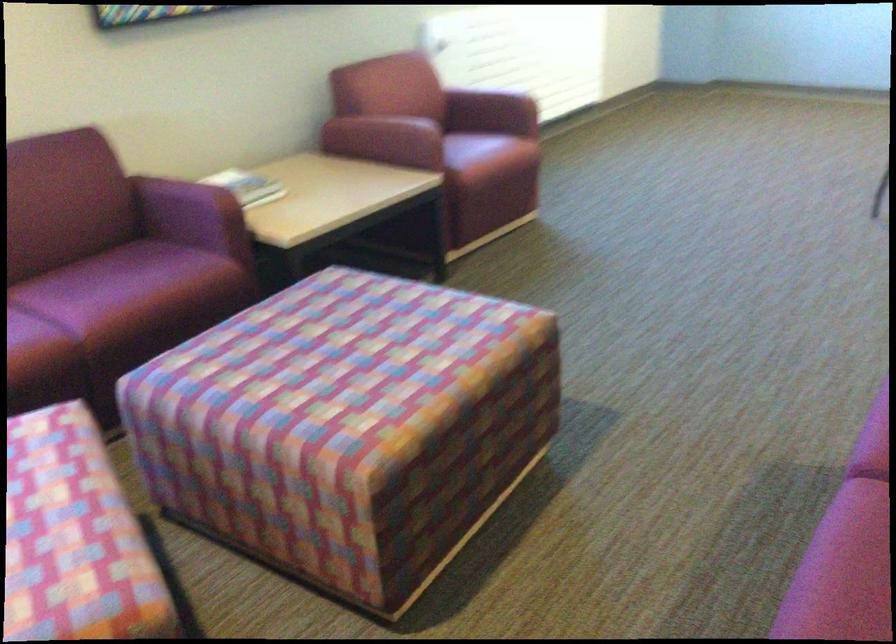
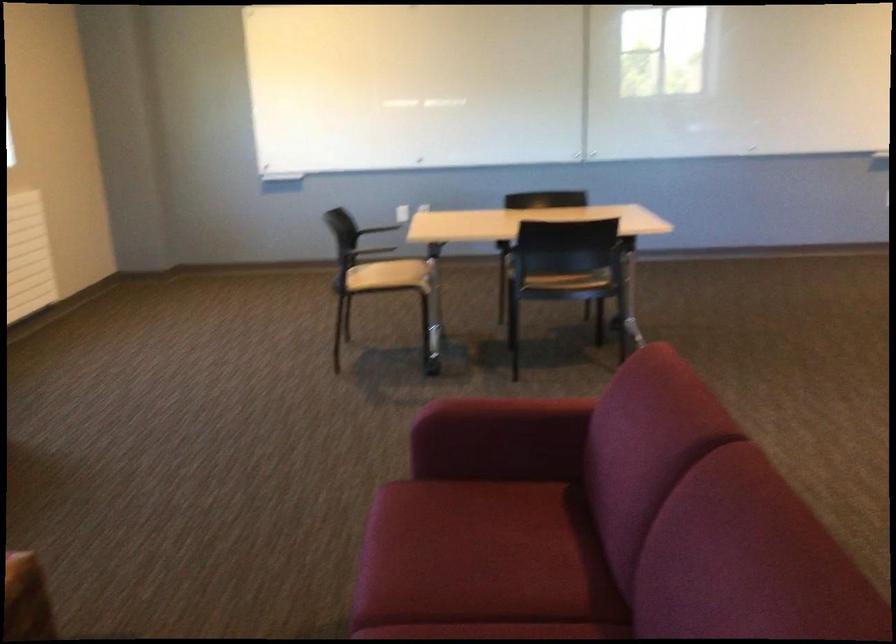
Question: Based on the continuous images, in which direction is the camera rotating? Reply with the corresponding letter.

Choices:
 (A) Left
 (B) Right
 (C) Up
 (D) Down

Answer: (B)